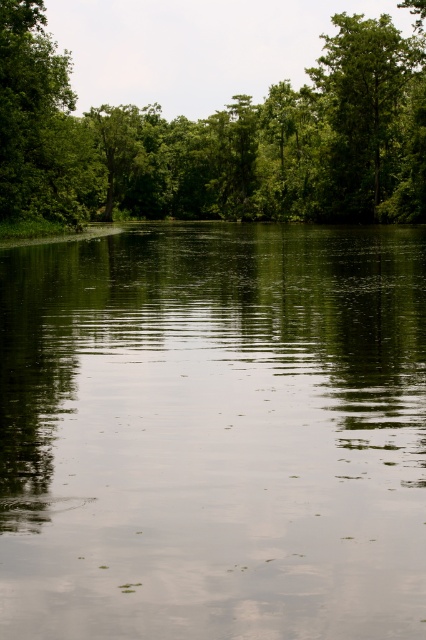
Based on the photo, you are standing on a path near the water and want to take a photo of the green reflective water at center and the green leafy forest at center. Which object should you focus on first if you want both to be in sharp focus?

You should focus on the green leafy forest at center first because it is further away than the green reflective water at center, so focusing on the closer object first might not keep both in focus. However, since the green reflective water at center is in front of the green leafy forest at center, adjusting focus to the middle distance between them would ensure both are sharp.

You are a hiker standing at the edge of the forest and want to cross the water body. The green reflective water at center is in front of you, and the green leafy forest at center is behind you. You have a 60 meter long rope. Can you use the rope to cross the water body?

The green reflective water at center and green leafy forest at center are 62.25 meters apart. Since the rope is only 60 meters long, it is not long enough to span the distance between the green reflective water at center and the green leafy forest at center. Therefore, you cannot use the rope to cross the water body.